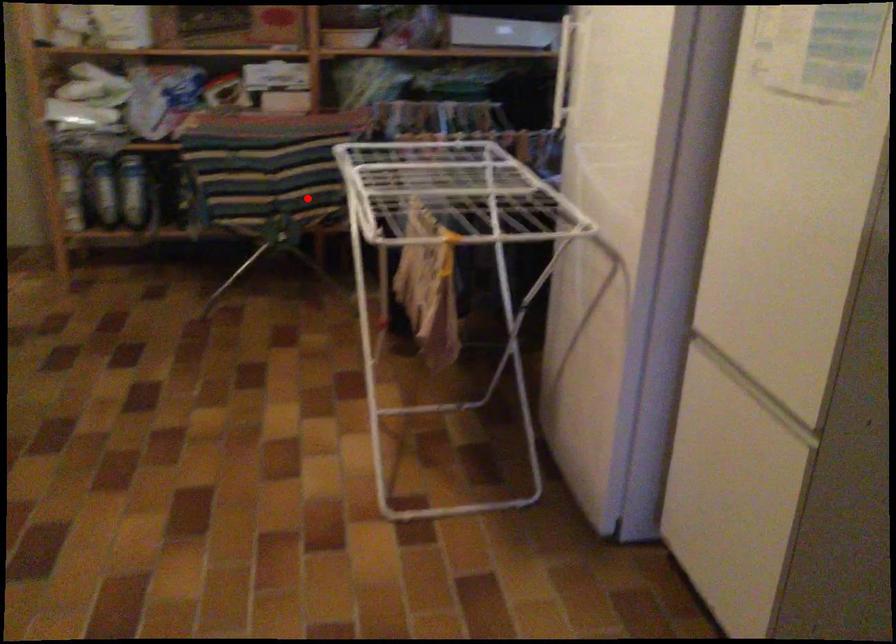
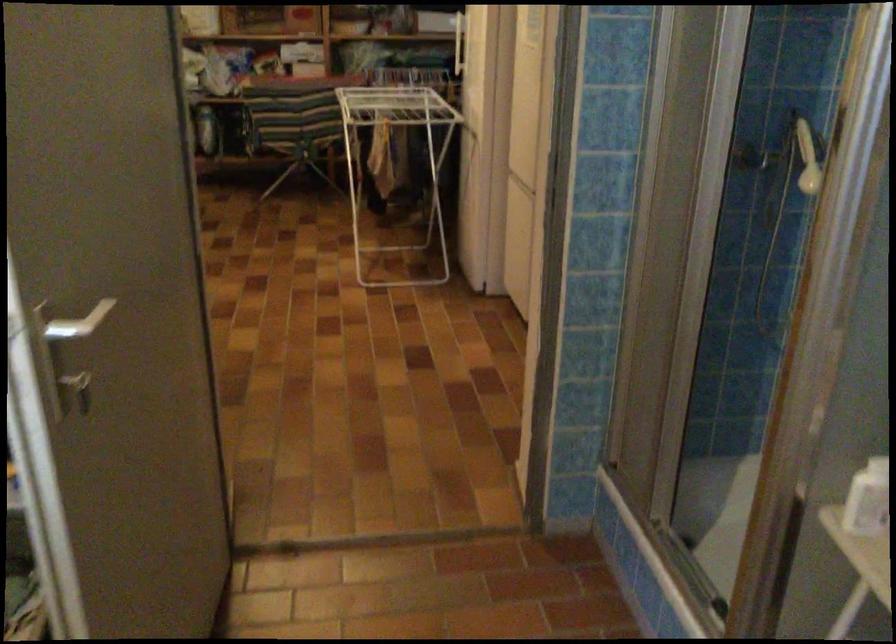
Question: I am providing you with two images of the same scene from different viewpoints. Image1 has a red point marked. In image2, the corresponding 3D location appears at what relative position? Reply with the corresponding letter.

Choices:
 (A) Closer
 (B) Farther

Answer: (B)